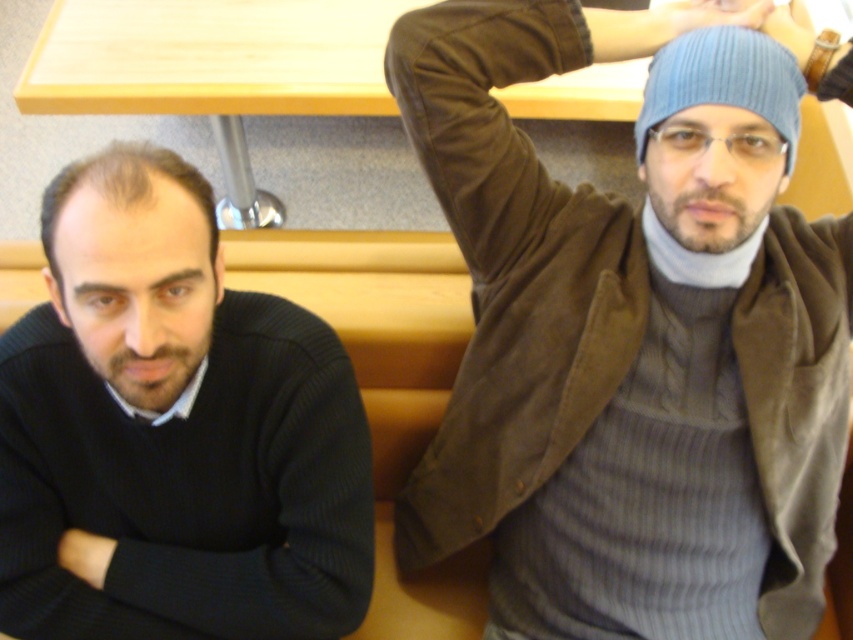
Question: Can you confirm if ribbed knit sweater at upper right is bigger than blue ribbed knit beanie at upper right?

Choices:
 (A) yes
 (B) no

Answer: (A)

Question: Which of the following is the farthest from the observer?

Choices:
 (A) (97, 467)
 (B) (724, 100)
 (C) (537, 273)
 (D) (137, 349)

Answer: (C)

Question: Considering the relative positions of matte black sweater at left and blue ribbed knit beanie at upper right in the image provided, where is matte black sweater at left located with respect to blue ribbed knit beanie at upper right?

Choices:
 (A) above
 (B) below

Answer: (B)

Question: Which point is farther to the camera?

Choices:
 (A) (18, 388)
 (B) (659, 193)
 (C) (50, 188)

Answer: (A)

Question: Is matte black sweater at left thinner than black ribbed sweater at left?

Choices:
 (A) no
 (B) yes

Answer: (A)

Question: Which point is closer to the camera?

Choices:
 (A) ribbed knit sweater at upper right
 (B) blue ribbed knit beanie at upper right
 (C) black ribbed sweater at left
 (D) matte black sweater at left

Answer: (C)